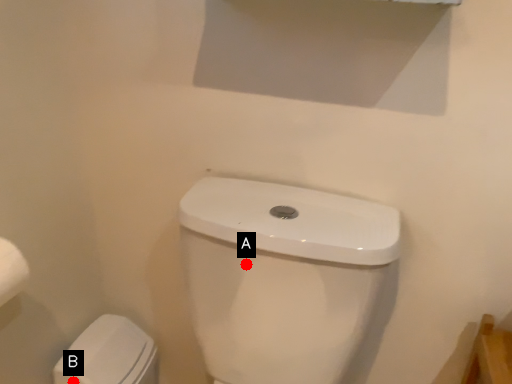
Question: Two points are circled on the image, labeled by A and B beside each circle. Which point is further to the camera?

Choices:
 (A) A is further
 (B) B is further

Answer: (B)